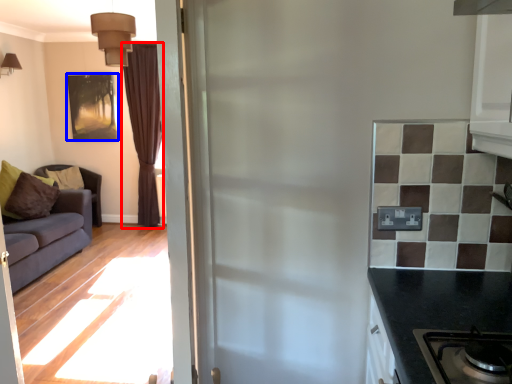
Question: Which point is further to the camera, curtain (highlighted by a red box) or picture frame (highlighted by a blue box)?

Choices:
 (A) curtain
 (B) picture frame

Answer: (B)